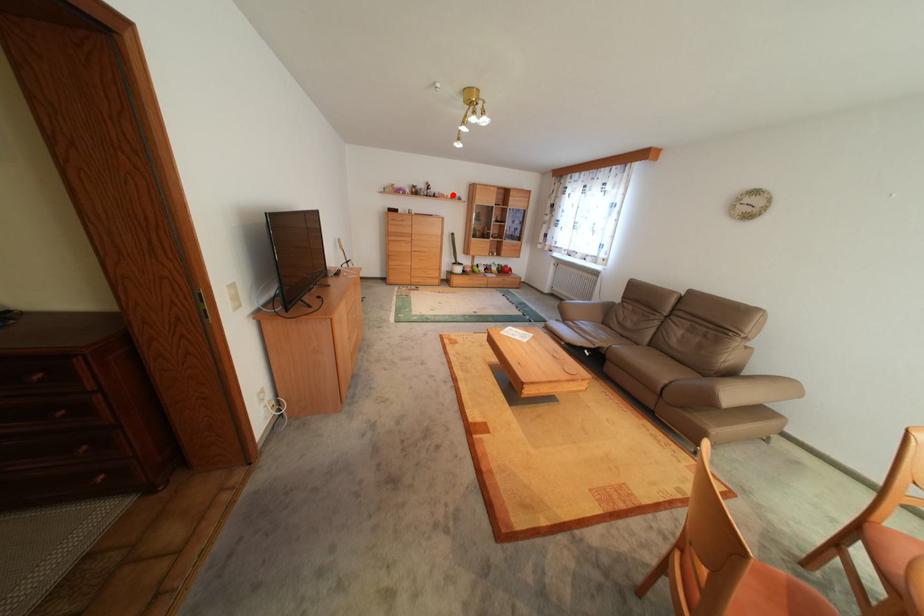
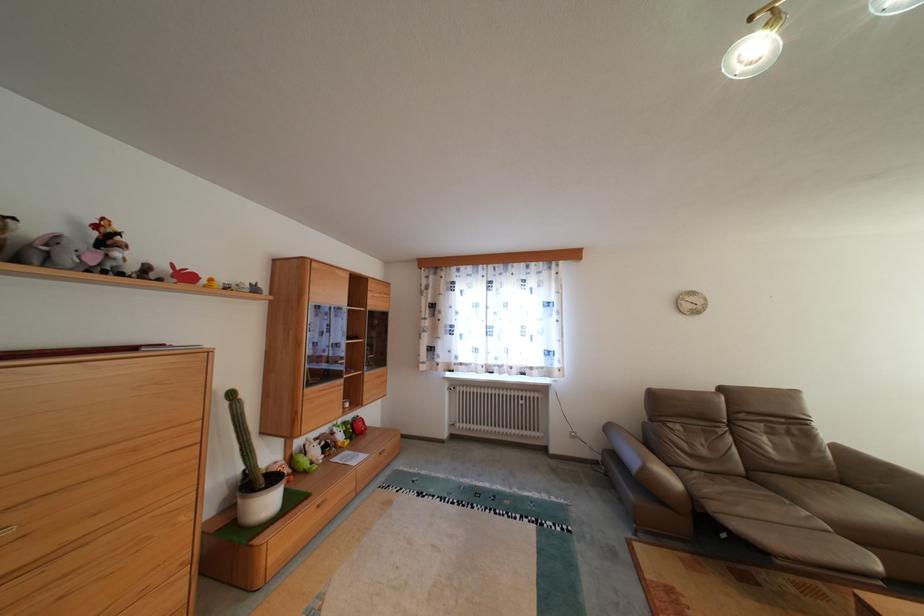
Question: I am providing you with two images of the same scene from different viewpoints. In image1, a red point is highlighted. Considering the same 3D point in image2, which of the following is correct?

Choices:
 (A) It is closer
 (B) It is farther

Answer: (B)